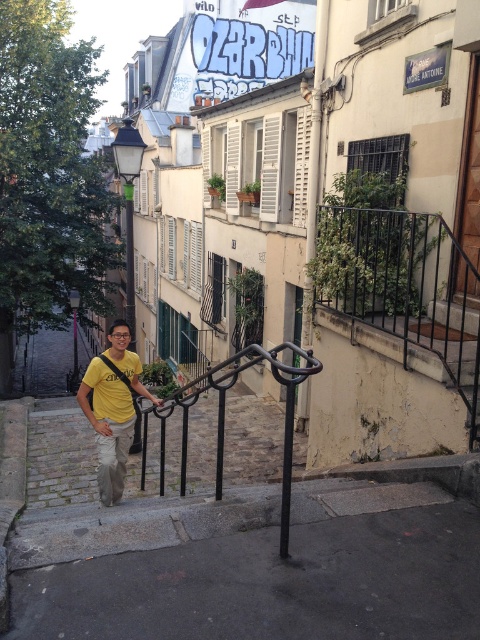
Question: Considering the relative positions of yellow matte shirt at center and yellow matte polo shirt at lower left in the image provided, where is yellow matte shirt at center located with respect to yellow matte polo shirt at lower left?

Choices:
 (A) above
 (B) below

Answer: (A)

Question: Which of these objects is positioned closest to the black metal/rail at right?

Choices:
 (A) black metal rail at center
 (B) yellow matte shirt at center
 (C) yellow matte polo shirt at lower left

Answer: (A)

Question: Does black metal/rail at right have a lesser width compared to yellow matte polo shirt at lower left?

Choices:
 (A) no
 (B) yes

Answer: (A)

Question: Among these points, which one is farthest from the camera?

Choices:
 (A) (420, 285)
 (B) (292, 401)

Answer: (A)

Question: Is black metal rail at center thinner than yellow matte shirt at center?

Choices:
 (A) no
 (B) yes

Answer: (A)

Question: Which object appears farthest from the camera in this image?

Choices:
 (A) yellow matte polo shirt at lower left
 (B) black metal rail at center
 (C) black metal/rail at right
 (D) yellow matte shirt at center

Answer: (A)